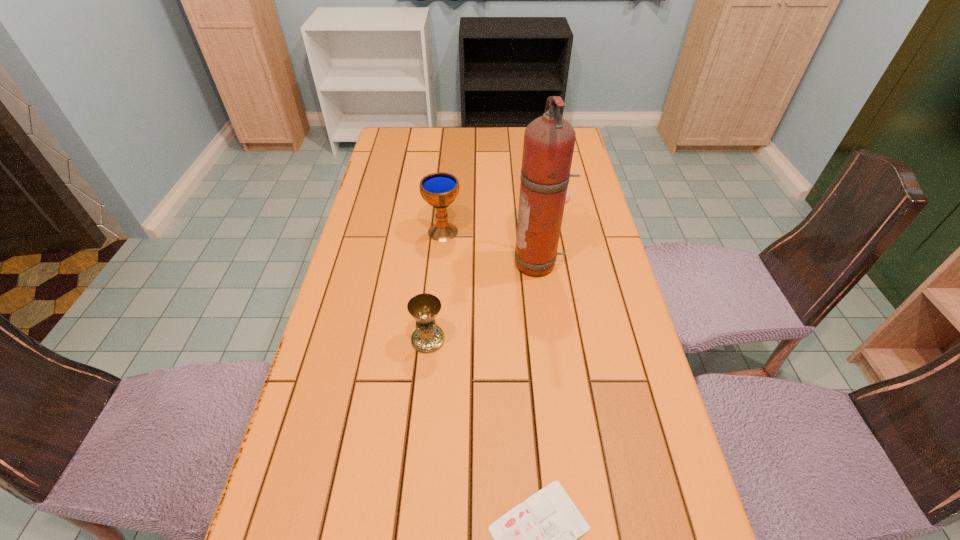
I want to click on vacant area situated on the right of the farther chalice, so click(583, 232).

Identify the location of free spot located 0.210m on the left of the nearer chalice. (324, 340).

At what (x,y) coordinates should I click in order to perform the action: click on vacant space located on the back of the doughnut. Please return your answer as a coordinate pair (x, y). Looking at the image, I should click on (543, 135).

Identify the location of fire extinguisher at the right edge. (549, 140).

Where is `doughnut located at the right edge`? Image resolution: width=960 pixels, height=540 pixels. doughnut located at the right edge is located at coordinates click(568, 193).

Locate an element on the screen. blank space at the far edge of the desktop is located at coordinates (486, 150).

Where is `free space at the left edge of the desktop`? The width and height of the screenshot is (960, 540). free space at the left edge of the desktop is located at coordinates (297, 477).

This screenshot has width=960, height=540. In the image, there is a desktop. In order to click on vacant area at the right edge in this screenshot , I will do `click(569, 218)`.

Locate an element on the screen. vacant space at the far right corner is located at coordinates (576, 130).

You are a GUI agent. You are given a task and a screenshot of the screen. Output one action in this format:
    pyautogui.click(x=<x>, y=<y>)
    Task: Click on the free spot between the taller chalice and the tallest object
    Image resolution: width=960 pixels, height=540 pixels.
    Given the screenshot: What is the action you would take?
    pyautogui.click(x=491, y=248)